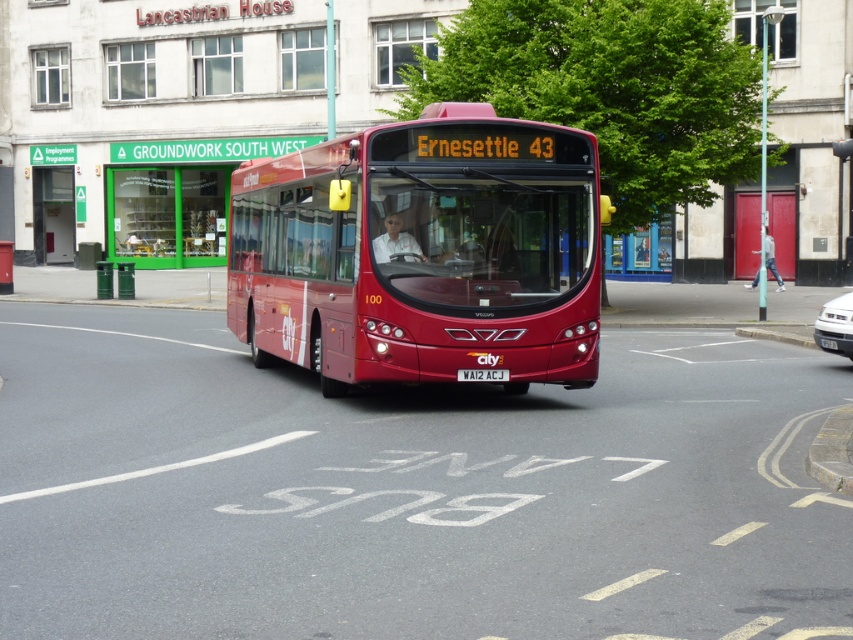
Can you confirm if silver metallic car at right is positioned above white plastic license plate at center?

Correct, silver metallic car at right is located above white plastic license plate at center.

Is silver metallic car at right to the right of white plastic license plate at center from the viewer's perspective?

Indeed, silver metallic car at right is positioned on the right side of white plastic license plate at center.

Who is more distant from viewer, (846, 326) or (459, 371)?

Positioned behind is point (846, 326).

Locate an element on the screen. The height and width of the screenshot is (640, 853). silver metallic car at right is located at coordinates tap(834, 324).

Who is taller, shiny red bus at center or white plastic license plate at center?

shiny red bus at center

Which is below, shiny red bus at center or white plastic license plate at center?

white plastic license plate at center is below.

At what (x,y) coordinates should I click in order to perform the action: click on shiny red bus at center. Please return your answer as a coordinate pair (x, y). Looking at the image, I should click on (422, 252).

What are the coordinates of `shiny red bus at center` in the screenshot? It's located at (422, 252).

Who is more forward, (409, 243) or (839, 317)?

Positioned in front is point (409, 243).

Who is positioned more to the left, shiny red bus at center or silver metallic car at right?

shiny red bus at center

Which is in front, point (392, 138) or point (839, 300)?

Point (392, 138) is in front.

Identify the location of shiny red bus at center. (422, 252).